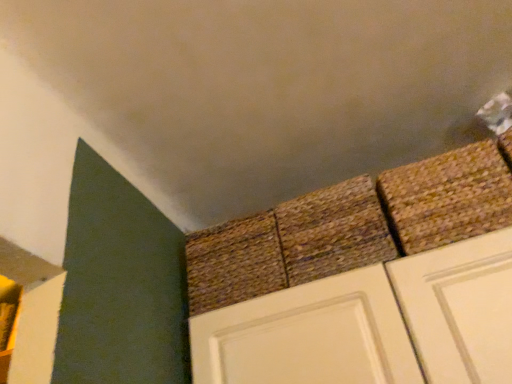
Question: Which direction should I rotate to face brown woven mat at center, which ranks as the 1th brick in left-to-right order, — up or down?

Choices:
 (A) down
 (B) up

Answer: (A)

Question: Considering the relative positions of brown woven rug at upper right, placed as the third brick when sorted from left to right, and brown woven mat at center, marked as the third brick in a right-to-left arrangement, in the image provided, is brown woven rug at upper right, placed as the third brick when sorted from left to right, in front of brown woven mat at center, marked as the third brick in a right-to-left arrangement,?

Choices:
 (A) no
 (B) yes

Answer: (B)

Question: From the image's perspective, is brown woven rug at upper right, placed as the third brick when sorted from left to right, on top of brown woven mat at center, which ranks as the 1th brick in left-to-right order?

Choices:
 (A) yes
 (B) no

Answer: (A)

Question: Is brown woven rug at upper right, placed as the third brick when sorted from left to right, completely or partially outside of brown woven mat at center, which ranks as the 1th brick in left-to-right order?

Choices:
 (A) no
 (B) yes

Answer: (B)

Question: Is brown woven rug at upper right, the first brick positioned from the right, far from brown woven mat at center, which ranks as the 1th brick in left-to-right order?

Choices:
 (A) no
 (B) yes

Answer: (A)

Question: Is brown woven rug at upper right, placed as the third brick when sorted from left to right, to the left of brown woven mat at center, which ranks as the 1th brick in left-to-right order, from the viewer's perspective?

Choices:
 (A) yes
 (B) no

Answer: (B)

Question: Is brown woven rug at upper right, the first brick positioned from the right, wider than brown woven mat at center, which ranks as the 1th brick in left-to-right order?

Choices:
 (A) yes
 (B) no

Answer: (B)

Question: Considering the relative sizes of brown woven mat at center, marked as the third brick in a right-to-left arrangement, and rustic woven mat at center, the 2th brick in the left-to-right sequence, in the image provided, is brown woven mat at center, marked as the third brick in a right-to-left arrangement, wider than rustic woven mat at center, the 2th brick in the left-to-right sequence,?

Choices:
 (A) yes
 (B) no

Answer: (B)

Question: Would you say brown woven mat at center, which ranks as the 1th brick in left-to-right order, is outside rustic woven mat at center, the 2th brick in the left-to-right sequence?

Choices:
 (A) no
 (B) yes

Answer: (B)

Question: Is brown woven mat at center, marked as the third brick in a right-to-left arrangement, positioned before rustic woven mat at center, the 2th brick in the left-to-right sequence?

Choices:
 (A) yes
 (B) no

Answer: (B)

Question: From the image's perspective, does brown woven mat at center, marked as the third brick in a right-to-left arrangement, appear higher than rustic woven mat at center, the 2th brick in the left-to-right sequence?

Choices:
 (A) no
 (B) yes

Answer: (A)

Question: Considering the relative sizes of brown woven mat at center, which ranks as the 1th brick in left-to-right order, and rustic woven mat at center, placed as the second brick when sorted from right to left, in the image provided, is brown woven mat at center, which ranks as the 1th brick in left-to-right order, thinner than rustic woven mat at center, placed as the second brick when sorted from right to left,?

Choices:
 (A) yes
 (B) no

Answer: (A)

Question: Is rustic woven mat at center, the 2th brick in the left-to-right sequence, closer to the viewer compared to brown woven rug at upper right, placed as the third brick when sorted from left to right?

Choices:
 (A) yes
 (B) no

Answer: (B)